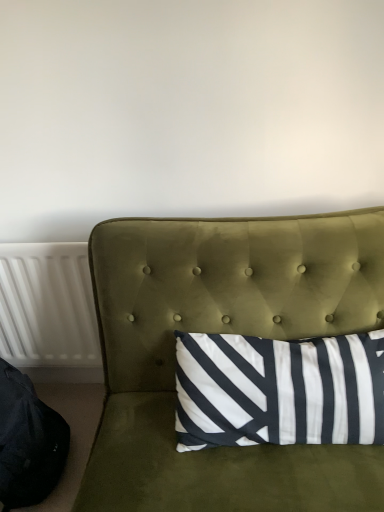
Question: Is black fabric bean bag chair at lower left closer to camera compared to white plastic radiator at left?

Choices:
 (A) no
 (B) yes

Answer: (B)

Question: Considering the relative sizes of black fabric bean bag chair at lower left and white plastic radiator at left in the image provided, is black fabric bean bag chair at lower left wider than white plastic radiator at left?

Choices:
 (A) yes
 (B) no

Answer: (A)

Question: From the image's perspective, is black fabric bean bag chair at lower left beneath white plastic radiator at left?

Choices:
 (A) yes
 (B) no

Answer: (A)

Question: Is black fabric bean bag chair at lower left thinner than white plastic radiator at left?

Choices:
 (A) yes
 (B) no

Answer: (B)

Question: From a real-world perspective, is black fabric bean bag chair at lower left physically below white plastic radiator at left?

Choices:
 (A) yes
 (B) no

Answer: (A)

Question: Considering the positions of point tap(41, 317) and point tap(1, 462), is point tap(41, 317) closer or farther from the camera than point tap(1, 462)?

Choices:
 (A) closer
 (B) farther

Answer: (B)

Question: Is white plastic radiator at left situated inside black fabric bean bag chair at lower left or outside?

Choices:
 (A) inside
 (B) outside

Answer: (B)

Question: Is white plastic radiator at left in front of or behind black fabric bean bag chair at lower left in the image?

Choices:
 (A) front
 (B) behind

Answer: (B)

Question: Looking at the image, does white plastic radiator at left seem bigger or smaller compared to black fabric bean bag chair at lower left?

Choices:
 (A) big
 (B) small

Answer: (B)

Question: From a real-world perspective, is black fabric bean bag chair at lower left physically located above or below white plastic radiator at left?

Choices:
 (A) above
 (B) below

Answer: (B)

Question: From their relative heights in the image, would you say black fabric bean bag chair at lower left is taller or shorter than white plastic radiator at left?

Choices:
 (A) tall
 (B) short

Answer: (B)

Question: Is black fabric bean bag chair at lower left to the left or to the right of white plastic radiator at left in the image?

Choices:
 (A) right
 (B) left

Answer: (B)

Question: Considering the positions of black fabric bean bag chair at lower left and white plastic radiator at left in the image, is black fabric bean bag chair at lower left bigger or smaller than white plastic radiator at left?

Choices:
 (A) big
 (B) small

Answer: (A)

Question: Considering the positions of white plastic radiator at left and velvet green studio couch at center in the image, is white plastic radiator at left wider or thinner than velvet green studio couch at center?

Choices:
 (A) thin
 (B) wide

Answer: (A)

Question: Is white plastic radiator at left to the left or to the right of velvet green studio couch at center in the image?

Choices:
 (A) left
 (B) right

Answer: (A)